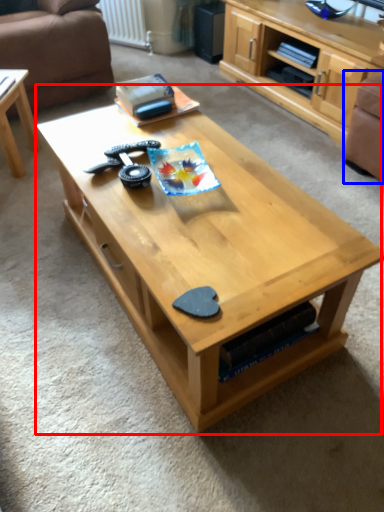
Question: Which object is further to the camera taking this photo, coffee table (highlighted by a red box) or armchair (highlighted by a blue box)?

Choices:
 (A) coffee table
 (B) armchair

Answer: (B)